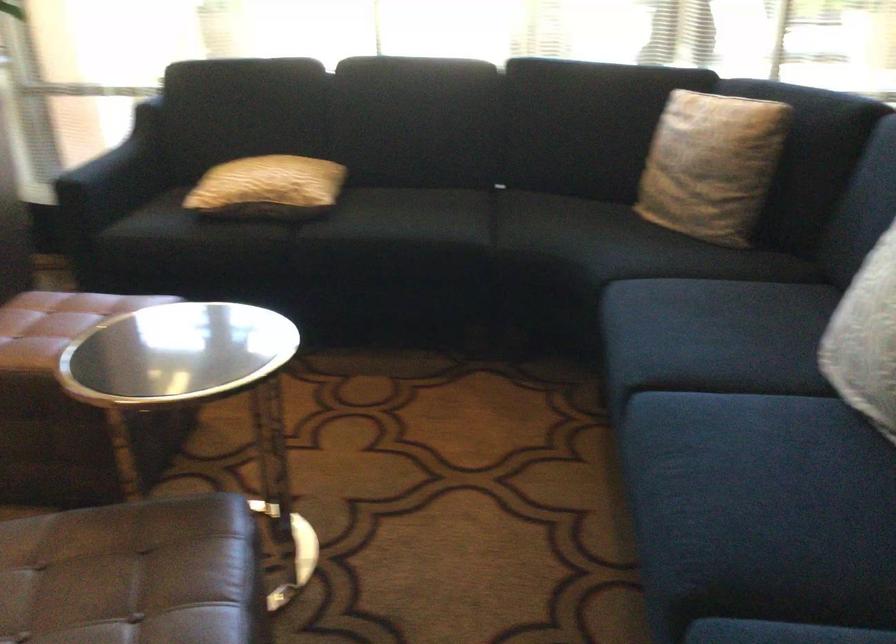
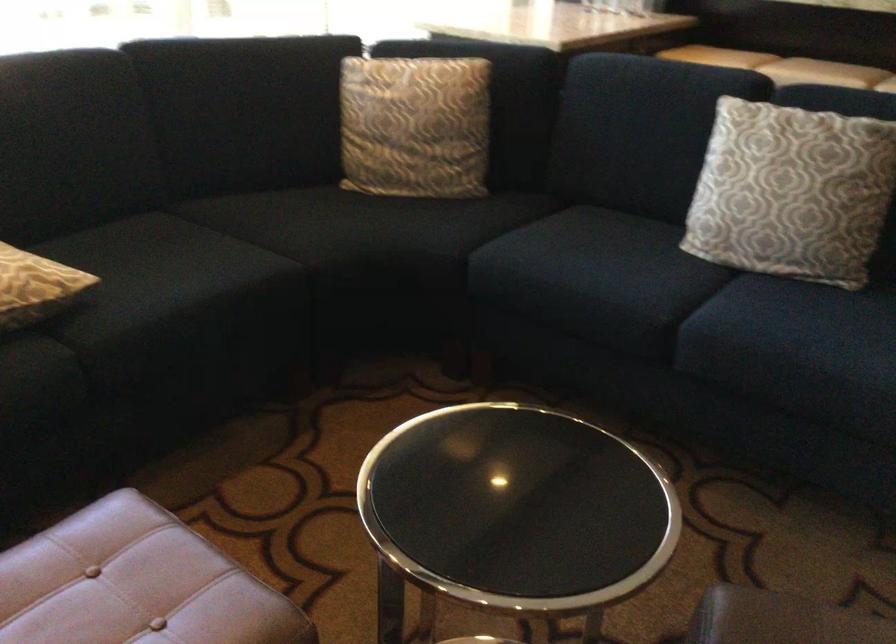
In the second image, find the point that corresponds to point 397,214 in the first image.

(161, 270)